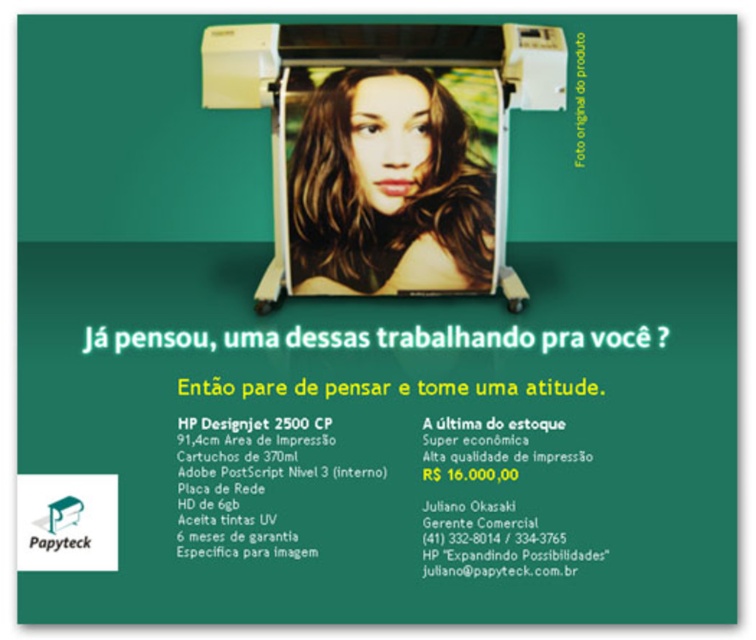
Is white plastic printer at center further to the viewer compared to shiny brown hair at center?

Yes.

Is white plastic printer at center wider than shiny brown hair at center?

Indeed, white plastic printer at center has a greater width compared to shiny brown hair at center.

Which is in front, point (279, 77) or point (463, 138)?

Point (463, 138) is more forward.

Image resolution: width=756 pixels, height=640 pixels. I want to click on white plastic printer at center, so click(386, 129).